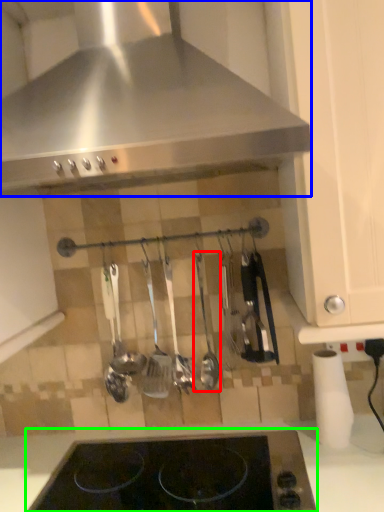
Question: Considering the real-world distances, which object is closest to silverware (highlighted by a red box)? kitchen appliance (highlighted by a blue box) or gas stove (highlighted by a green box).

Choices:
 (A) kitchen appliance
 (B) gas stove

Answer: (B)